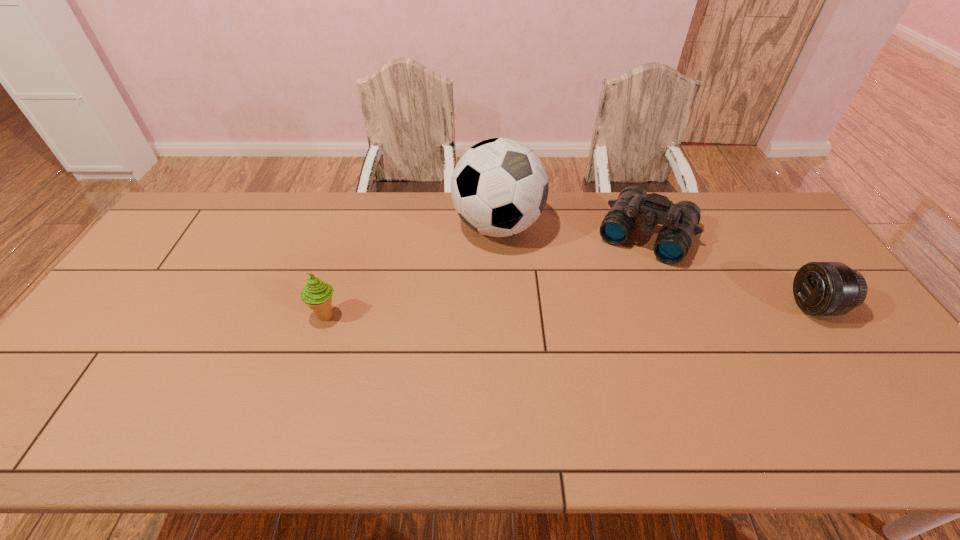
Identify the location of vacant area that lies between the binoculars and the leftmost object. (486, 275).

At what (x,y) coordinates should I click in order to perform the action: click on empty location between the rightmost object and the leftmost object. Please return your answer as a coordinate pair (x, y). This screenshot has height=540, width=960. Looking at the image, I should click on (570, 310).

Locate an element on the screen. This screenshot has height=540, width=960. free space between the tallest object and the icecream is located at coordinates (412, 271).

What are the coordinates of `object that ranks as the second closest to the third object from left to right` in the screenshot? It's located at (820, 288).

Choose which object is the nearest neighbor to the third object from left to right. Please provide its 2D coordinates. Your answer should be formatted as a tuple, i.e. [(x, y)], where the tuple contains the x and y coordinates of a point satisfying the conditions above.

[(499, 187)]

Identify the location of vacant area in the image that satisfies the following two spatial constraints: 1. on the front side of the third object from left to right; 2. on the front-facing side of the rightmost object. (676, 306).

Locate an element on the screen. This screenshot has width=960, height=540. vacant space that satisfies the following two spatial constraints: 1. on the front side of the third object from left to right; 2. on the right side of the soccer ball is located at coordinates (498, 234).

Locate an element on the screen. The image size is (960, 540). vacant space that satisfies the following two spatial constraints: 1. on the front side of the rightmost object; 2. on the front-facing side of the third object from right to left is located at coordinates (501, 306).